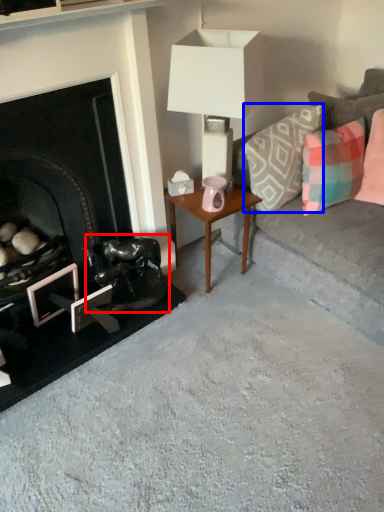
Question: Among these objects, which one is nearest to the camera, swivel chair (highlighted by a red box) or pillow (highlighted by a blue box)?

Choices:
 (A) swivel chair
 (B) pillow

Answer: (B)